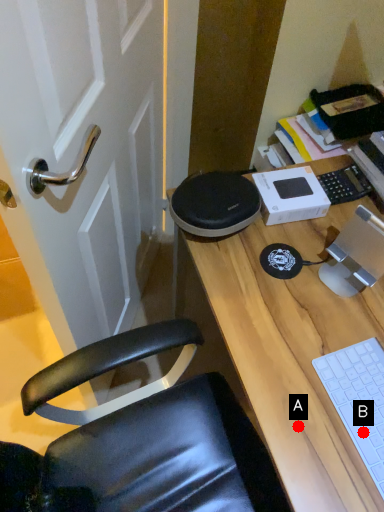
Question: Two points are circled on the image, labeled by A and B beside each circle. Which point is closer to the camera?

Choices:
 (A) A is closer
 (B) B is closer

Answer: (B)